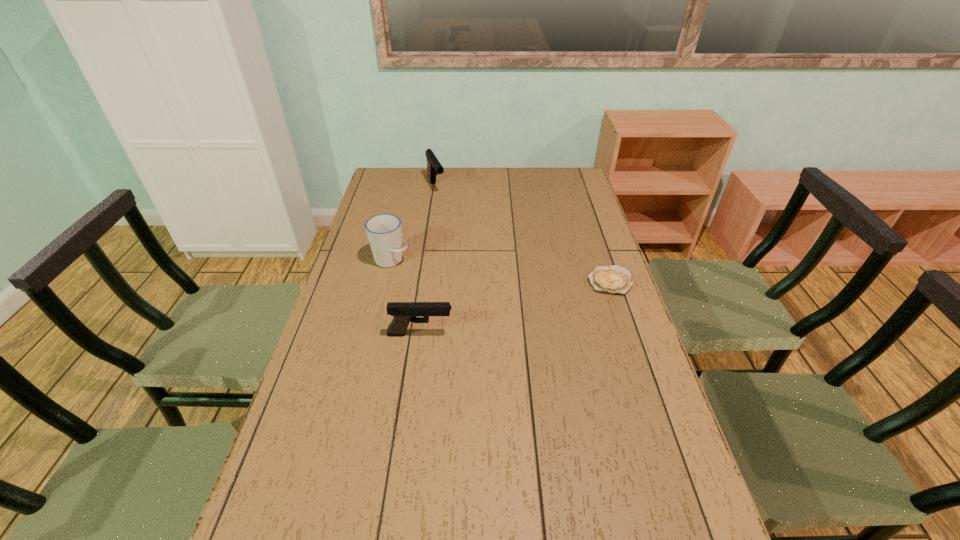
Find the location of a particular element. Image resolution: width=960 pixels, height=540 pixels. the nearer pistol is located at coordinates (403, 313).

This screenshot has height=540, width=960. I want to click on the nearest object, so click(x=403, y=313).

Find the location of a particular element. The image size is (960, 540). quiche is located at coordinates (614, 279).

Image resolution: width=960 pixels, height=540 pixels. Identify the location of the shortest object. (614, 279).

Locate an element on the screen. The height and width of the screenshot is (540, 960). the taller pistol is located at coordinates (434, 167).

Locate an element on the screen. The height and width of the screenshot is (540, 960). the farther pistol is located at coordinates (434, 167).

Where is `cup`? The image size is (960, 540). cup is located at coordinates (383, 230).

At what (x,y) coordinates should I click in order to perform the action: click on free spot located on the front-facing side of the nearest object. Please return your answer as a coordinate pair (x, y). The image size is (960, 540). Looking at the image, I should click on (522, 334).

Where is `free space located 0.120m on the left of the shortest object`? The image size is (960, 540). free space located 0.120m on the left of the shortest object is located at coordinates (551, 281).

Locate an element on the screen. free region located at the barrel of the taller pistol is located at coordinates (444, 209).